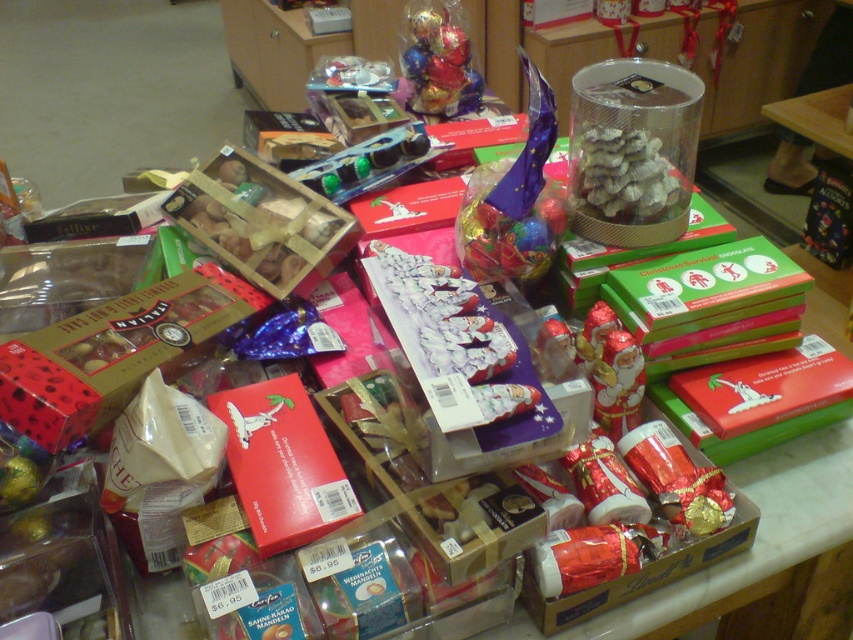
You are a customer looking at the holiday confectionery display. You see the shiny silver candy at center and the shiny foil wrapped chocolates at center. Which item is positioned to the right of the other?

The shiny silver candy at center is to the right of the shiny foil wrapped chocolates at center.

You are a customer at the store looking at the holiday confectionery display. You see the shiny silver candy at center and the shiny foil wrapped chocolates at center. Which item takes up more space on the table?

The shiny foil wrapped chocolates at center occupy more space than the shiny silver candy at center, so the chocolates take up more space on the table.

Based on the photo, you are a customer looking at the shiny silver candy at center and the shiny foil wrapped chocolates at center. Which one is placed lower on the table?

The shiny silver candy at center is positioned under the shiny foil wrapped chocolates at center, so it is placed lower on the table.